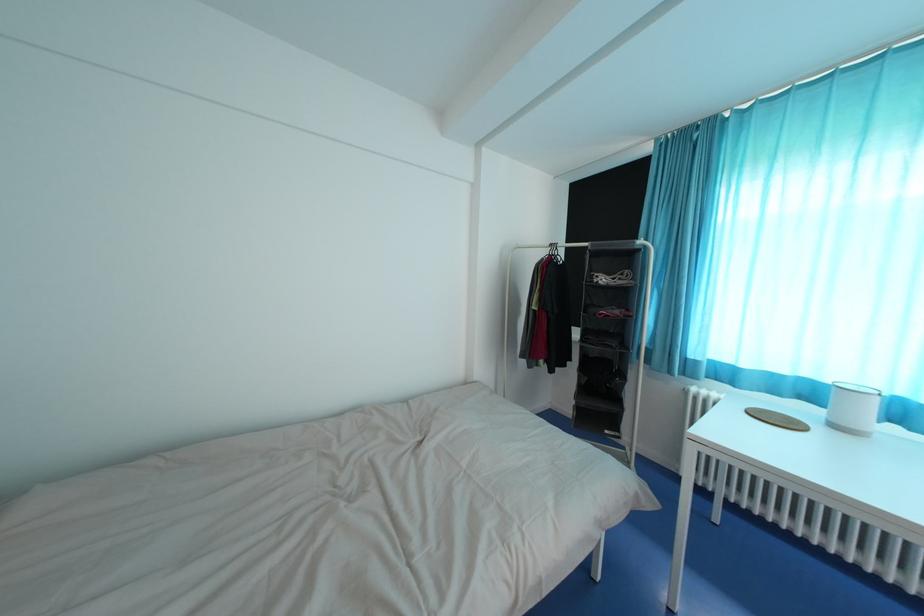
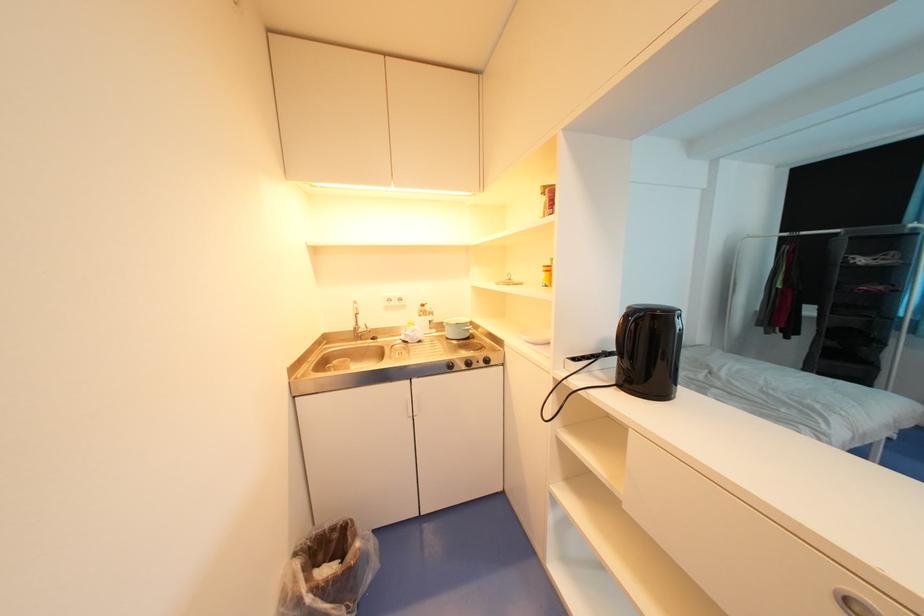
Which direction would the cameraman need to move to produce the second image?

The movement direction of the cameraman is left, backward.